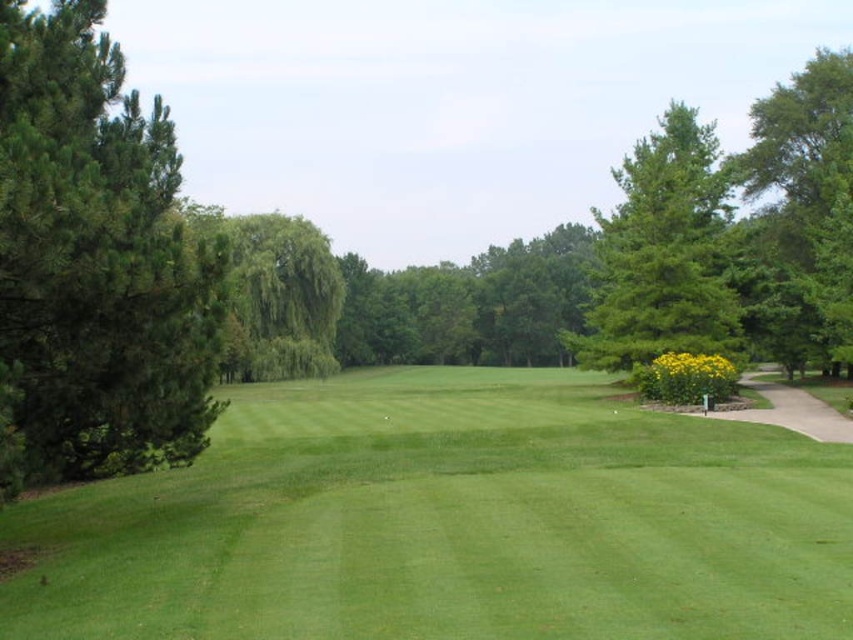
Question: Which object is positioned farthest from the green leafy tree at right?

Choices:
 (A) green needle-like at left
 (B) green matte tree at upper right

Answer: (A)

Question: Is green smooth grass at center above green matte tree at upper right?

Choices:
 (A) no
 (B) yes

Answer: (A)

Question: Can you confirm if green matte tree at upper right is positioned to the right of green leafy tree at center?

Choices:
 (A) no
 (B) yes

Answer: (B)

Question: Which point appears farthest from the camera in this image?

Choices:
 (A) (224, 483)
 (B) (805, 356)

Answer: (B)

Question: Considering the real-world distances, which object is closest to the green leafy tree at right?

Choices:
 (A) green smooth grass at center
 (B) green leafy tree at center

Answer: (A)

Question: Can you confirm if green matte tree at upper right is thinner than green leafy tree at center?

Choices:
 (A) yes
 (B) no

Answer: (B)